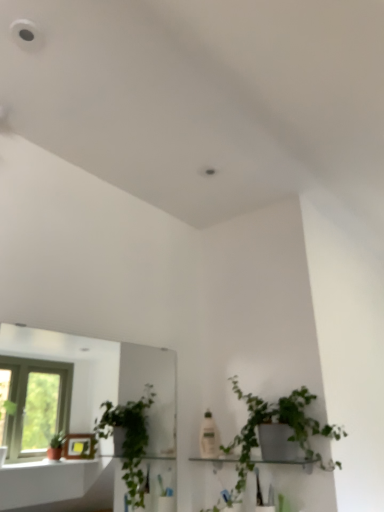
At what (x,y) coordinates should I click in order to perform the action: click on white glossy shelf at center. Please return your answer as a coordinate pair (x, y). Looking at the image, I should click on (x=289, y=462).

What do you see at coordinates (289, 462) in the screenshot? This screenshot has width=384, height=512. I see `white glossy shelf at center` at bounding box center [289, 462].

Describe the element at coordinates (279, 423) in the screenshot. I see `green matte plant at center-right` at that location.

What do you see at coordinates (104, 376) in the screenshot?
I see `clear glass mirror at left` at bounding box center [104, 376].

I want to click on white glossy shelf at center, so pyautogui.click(x=289, y=462).

Considering the positions of point (302, 459) and point (279, 402), is point (302, 459) closer or farther from the camera than point (279, 402)?

Point (302, 459) is positioned closer to the camera compared to point (279, 402).

The image size is (384, 512). I want to click on shelf below the green matte plant at center-right (from the image's perspective), so click(x=289, y=462).

Could you tell me if white glossy shelf at center is turned towards green matte plant at center-right?

Yes, white glossy shelf at center is turned towards green matte plant at center-right.

Which object is thinner, white glossy shelf at center or green matte plant at center-right?

white glossy shelf at center is thinner.

From the image's perspective, is clear glass mirror at left below white glossy shelf at center?

Actually, clear glass mirror at left appears above white glossy shelf at center in the image.

Locate an element on the screen. The width and height of the screenshot is (384, 512). shelf to the right of clear glass mirror at left is located at coordinates click(x=289, y=462).

Does clear glass mirror at left turn towards white glossy shelf at center?

Yes, clear glass mirror at left is oriented towards white glossy shelf at center.

Is clear glass mirror at left inside the boundaries of white glossy shelf at center, or outside?

The correct answer is: outside.

Is green matte plant at center-right positioned with its back to white glossy shelf at center?

Correct, green matte plant at center-right is looking away from white glossy shelf at center.

Measure the distance from green matte plant at center-right to white glossy shelf at center.

green matte plant at center-right is 4.83 inches from white glossy shelf at center.

Which object is positioned more to the left, green matte plant at center-right or white glossy shelf at center?

white glossy shelf at center.

Looking at their sizes, would you say green matte plant at center-right is wider or thinner than white glossy shelf at center?

Clearly, green matte plant at center-right has more width compared to white glossy shelf at center.

Based on the photo, from the image's perspective, which is above, white glossy shelf at center or clear glass mirror at left?

clear glass mirror at left is shown above in the image.

Would you say white glossy shelf at center is to the left or to the right of clear glass mirror at left in the picture?

From the image, it's evident that white glossy shelf at center is to the right of clear glass mirror at left.

Measure the distance between white glossy shelf at center and clear glass mirror at left.

white glossy shelf at center is 7.88 feet away from clear glass mirror at left.

The image size is (384, 512). Find the location of `houseplant behind the clear glass mirror at left`. houseplant behind the clear glass mirror at left is located at coordinates (279, 423).

Can you tell me how much green matte plant at center-right and clear glass mirror at left differ in facing direction?

green matte plant at center-right and clear glass mirror at left are facing 92.1 degrees away from each other.

Based on the photo, choose the correct answer: Is green matte plant at center-right inside clear glass mirror at left or outside it?

green matte plant at center-right is not inside clear glass mirror at left, it's outside.

From the image's perspective, is green matte plant at center-right above clear glass mirror at left?

No, from the image's perspective, green matte plant at center-right is not above clear glass mirror at left.

In the scene shown: Visually, is clear glass mirror at left positioned to the left or to the right of green matte plant at center-right?

clear glass mirror at left is to the left of green matte plant at center-right.

Is green matte plant at center-right at the back of clear glass mirror at left?

No, green matte plant at center-right is not at the back of clear glass mirror at left.

In terms of height, does clear glass mirror at left look taller or shorter compared to green matte plant at center-right?

Clearly, clear glass mirror at left is taller compared to green matte plant at center-right.

How different are the orientations of clear glass mirror at left and green matte plant at center-right in degrees?

92.1 degrees separate the facing orientations of clear glass mirror at left and green matte plant at center-right.

Identify the location of houseplant in front of the white glossy shelf at center. (279, 423).

Find the location of a particular element. shelf below the clear glass mirror at left (from a real-world perspective) is located at coordinates (289, 462).

Estimate the real-world distances between objects in this image. Which object is closer to green matte plant at center-right, clear glass mirror at left or white glossy shelf at center?

white glossy shelf at center is positioned closer to the anchor green matte plant at center-right.

Based on their spatial positions, is clear glass mirror at left or green matte plant at center-right closer to white glossy shelf at center?

green matte plant at center-right is positioned closer to the anchor white glossy shelf at center.

Looking at the image, which one is located closer to white glossy shelf at center, green matte plant at center-right or clear glass mirror at left?

Among the two, green matte plant at center-right is located nearer to white glossy shelf at center.

Considering their positions, is green matte plant at center-right positioned closer to clear glass mirror at left than white glossy shelf at center?

green matte plant at center-right.

When comparing their distances from clear glass mirror at left, does white glossy shelf at center or green matte plant at center-right seem closer?

Based on the image, green matte plant at center-right appears to be nearer to clear glass mirror at left.

Based on their spatial positions, is white glossy shelf at center or clear glass mirror at left closer to green matte plant at center-right?

Among the two, white glossy shelf at center is located nearer to green matte plant at center-right.

You are a GUI agent. You are given a task and a screenshot of the screen. Output one action in this format:
    pyautogui.click(x=<x>, y=<y>)
    Task: Click on the shelf located between clear glass mirror at left and green matte plant at center-right in the left-right direction
    The width and height of the screenshot is (384, 512).
    Given the screenshot: What is the action you would take?
    pyautogui.click(x=289, y=462)